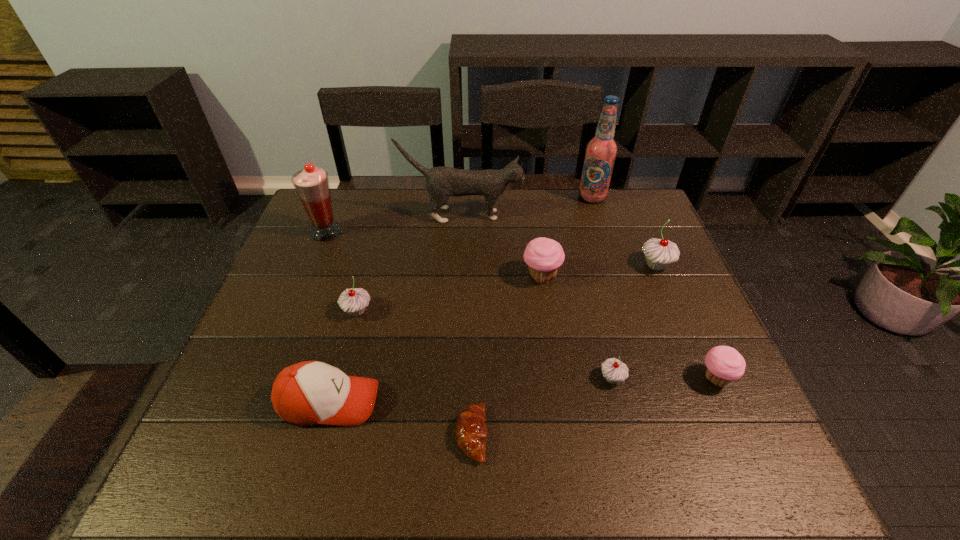
You are a GUI agent. You are given a task and a screenshot of the screen. Output one action in this format:
    pyautogui.click(x=<x>, y=<y>)
    Task: Click on the orange baseball cap
    The image size is (960, 540).
    Given the screenshot: What is the action you would take?
    pyautogui.click(x=311, y=392)

The image size is (960, 540). Identify the location of the right pink cupcake. (724, 364).

Where is `the nearer pink cupcake`? the nearer pink cupcake is located at coordinates (724, 364).

The height and width of the screenshot is (540, 960). I want to click on the third cupcake from left to right, so click(614, 370).

This screenshot has height=540, width=960. I want to click on the nearest gray cupcake, so click(x=614, y=370).

The image size is (960, 540). What are the coordinates of `the shortest object` in the screenshot? It's located at (471, 431).

The width and height of the screenshot is (960, 540). Find the location of `brown crescent roll`. brown crescent roll is located at coordinates (471, 431).

At what (x,y) coordinates should I click in order to perform the action: click on free region located on the front of the blue alcohol. Please return your answer as a coordinate pair (x, y). Image resolution: width=960 pixels, height=540 pixels. Looking at the image, I should click on click(x=614, y=267).

Find the location of a particular element. This screenshot has width=960, height=540. vacant space located 0.320m at the face of the cat is located at coordinates (621, 215).

Where is `free space located 0.310m on the front of the red smoothie`? Image resolution: width=960 pixels, height=540 pixels. free space located 0.310m on the front of the red smoothie is located at coordinates (290, 321).